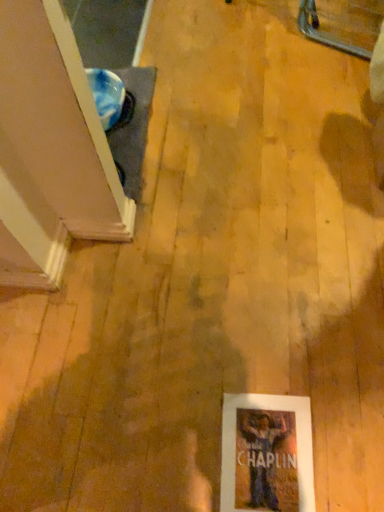
The height and width of the screenshot is (512, 384). In order to click on free space to the back side of white paper poster at lower center in this screenshot , I will do `click(246, 356)`.